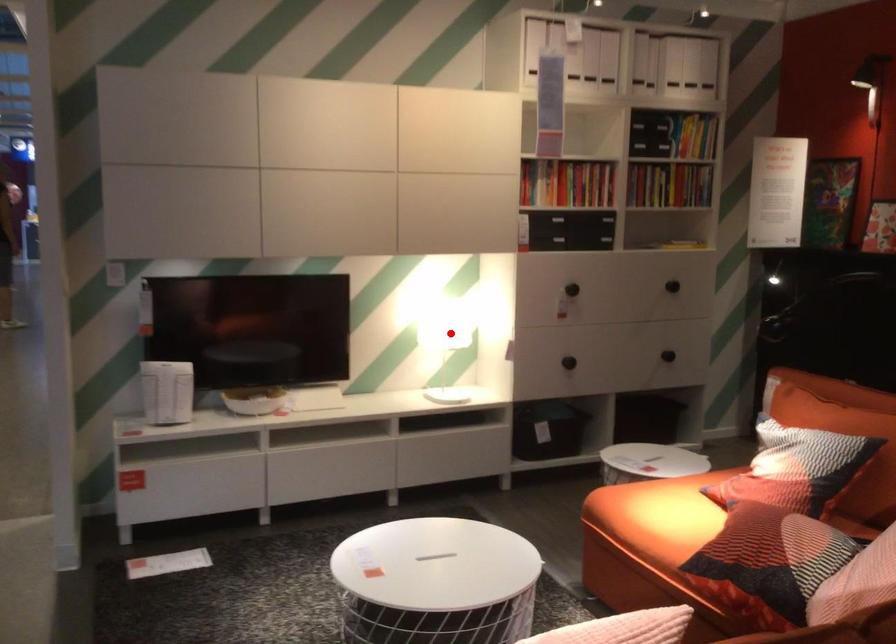
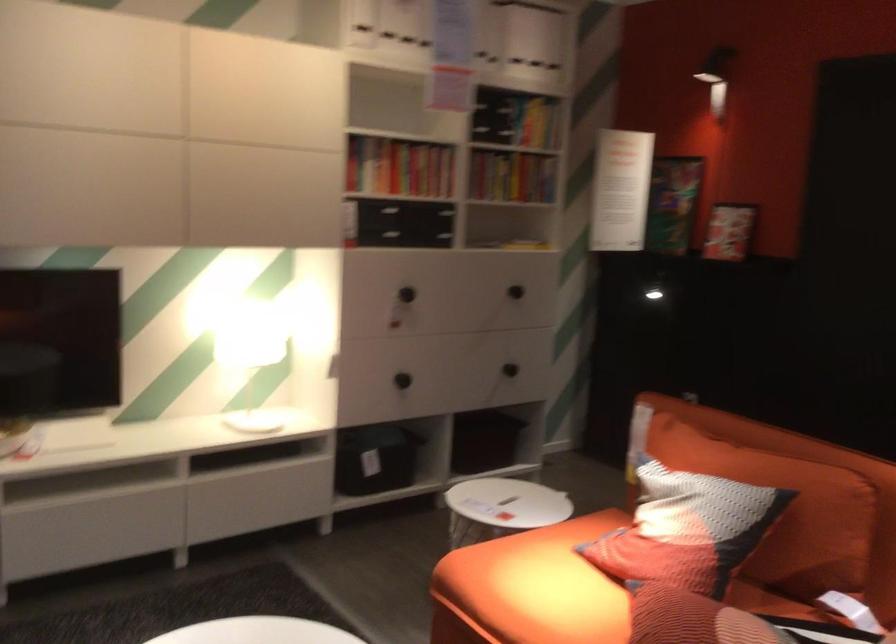
Question: I am providing you with two images of the same scene from different viewpoints. A red point is marked on the first image. At the location where the point appears in image 1, is it still visible in image 2?

Choices:
 (A) Yes
 (B) No

Answer: (A)